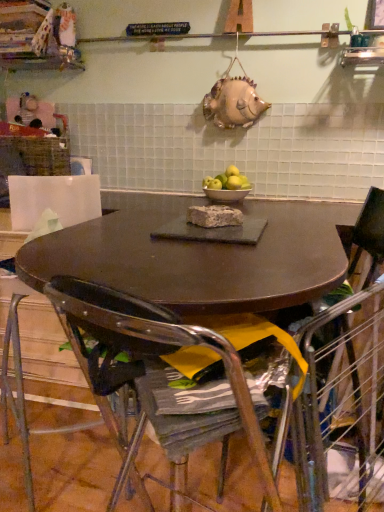
Question: Is metallic wire armchair at lower right in front of metallic wire chair at lower right, the 1th chair from the back?

Choices:
 (A) no
 (B) yes

Answer: (B)

Question: Is metallic wire armchair at lower right facing towards metallic wire chair at lower right, the 1th chair from the back?

Choices:
 (A) yes
 (B) no

Answer: (A)

Question: Is metallic wire armchair at lower right further to the viewer compared to metallic wire chair at lower right, the 1th chair from the back?

Choices:
 (A) yes
 (B) no

Answer: (B)

Question: Can you confirm if metallic wire armchair at lower right is positioned to the left of metallic wire chair at lower right, the 1th chair from the back?

Choices:
 (A) no
 (B) yes

Answer: (A)

Question: From a real-world perspective, is metallic wire armchair at lower right below metallic wire chair at lower right, the 2th chair from the front?

Choices:
 (A) no
 (B) yes

Answer: (B)

Question: Considering the relative positions of white ceramic bowl at center and brown crumbly cake at center in the image provided, is white ceramic bowl at center to the left or to the right of brown crumbly cake at center?

Choices:
 (A) right
 (B) left

Answer: (A)

Question: Is white ceramic bowl at center taller or shorter than brown crumbly cake at center?

Choices:
 (A) short
 (B) tall

Answer: (B)

Question: From the image's perspective, is white ceramic bowl at center above or below brown crumbly cake at center?

Choices:
 (A) above
 (B) below

Answer: (A)

Question: Considering the positions of white ceramic bowl at center and brown crumbly cake at center in the image, is white ceramic bowl at center wider or thinner than brown crumbly cake at center?

Choices:
 (A) thin
 (B) wide

Answer: (B)

Question: Is metallic silver chair at lower center, the 1th chair from the front, in front of or behind metallic wire armchair at lower right in the image?

Choices:
 (A) front
 (B) behind

Answer: (A)

Question: Is point (72, 339) positioned closer to the camera than point (352, 475)?

Choices:
 (A) closer
 (B) farther

Answer: (A)

Question: Would you say metallic silver chair at lower center, marked as the second chair in a back-to-front arrangement, is inside or outside metallic wire armchair at lower right?

Choices:
 (A) inside
 (B) outside

Answer: (B)

Question: In terms of size, does metallic silver chair at lower center, marked as the second chair in a back-to-front arrangement, appear bigger or smaller than metallic wire armchair at lower right?

Choices:
 (A) small
 (B) big

Answer: (A)

Question: Is white ceramic bowl at center taller or shorter than metallic silver chair at lower center, the 1th chair from the front?

Choices:
 (A) short
 (B) tall

Answer: (A)

Question: Which is correct: white ceramic bowl at center is inside metallic silver chair at lower center, marked as the second chair in a back-to-front arrangement, or outside of it?

Choices:
 (A) inside
 (B) outside

Answer: (B)